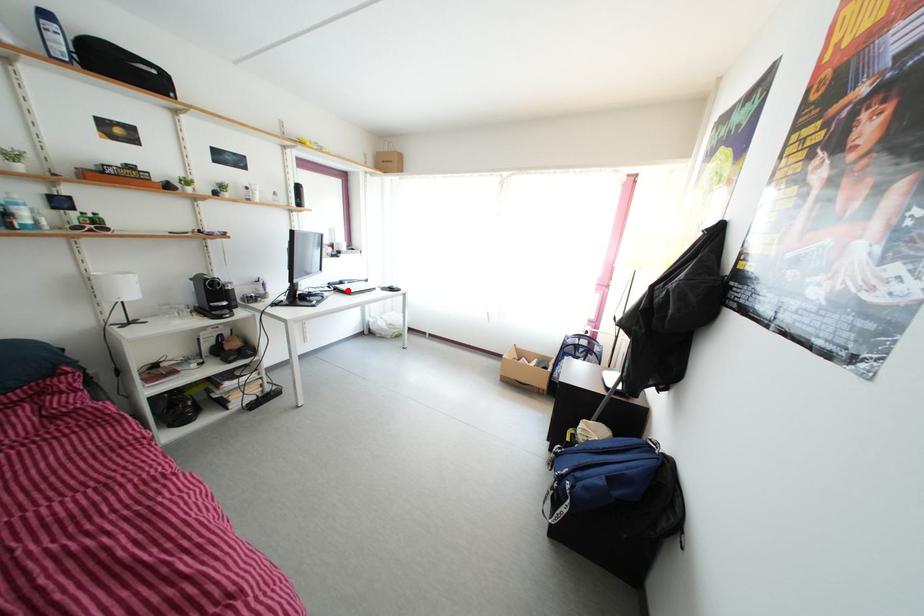
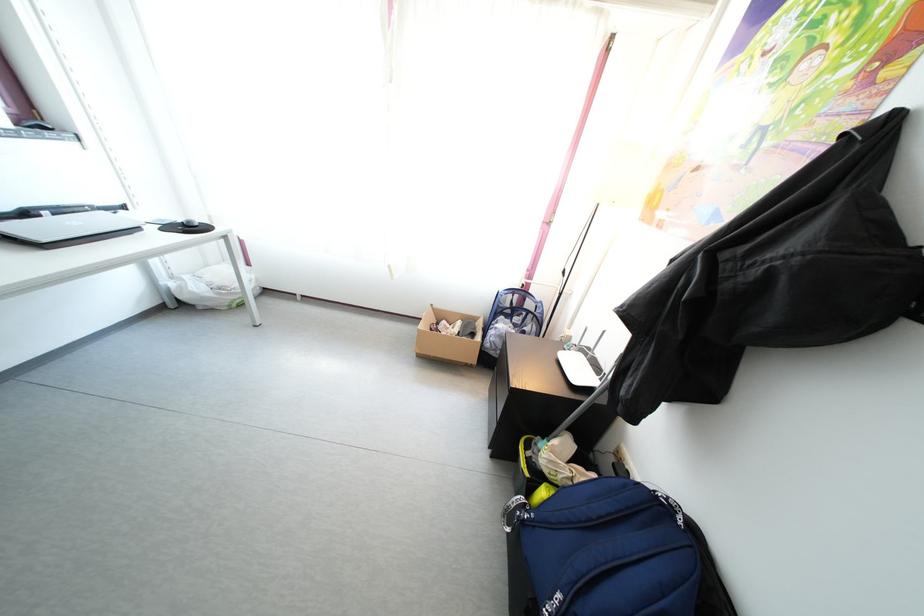
Question: I am providing you with two images of the same scene from different viewpoints. A red point is shown in image1. For the corresponding object point in image2, is it positioned nearer or farther from the camera?

Choices:
 (A) Nearer
 (B) Farther

Answer: (B)